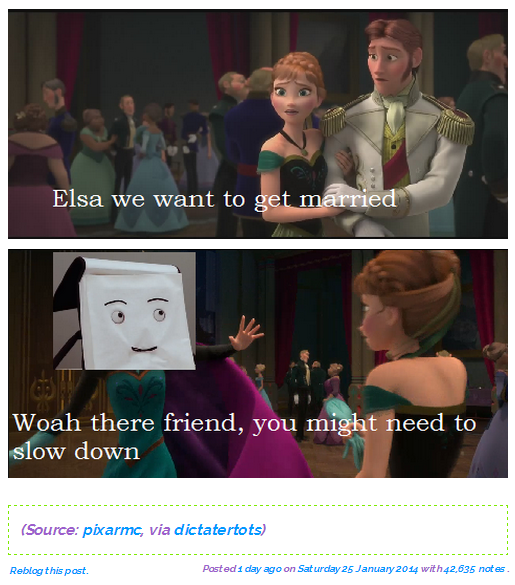
The height and width of the screenshot is (585, 515). I want to click on window, so click(306, 322), click(339, 326).